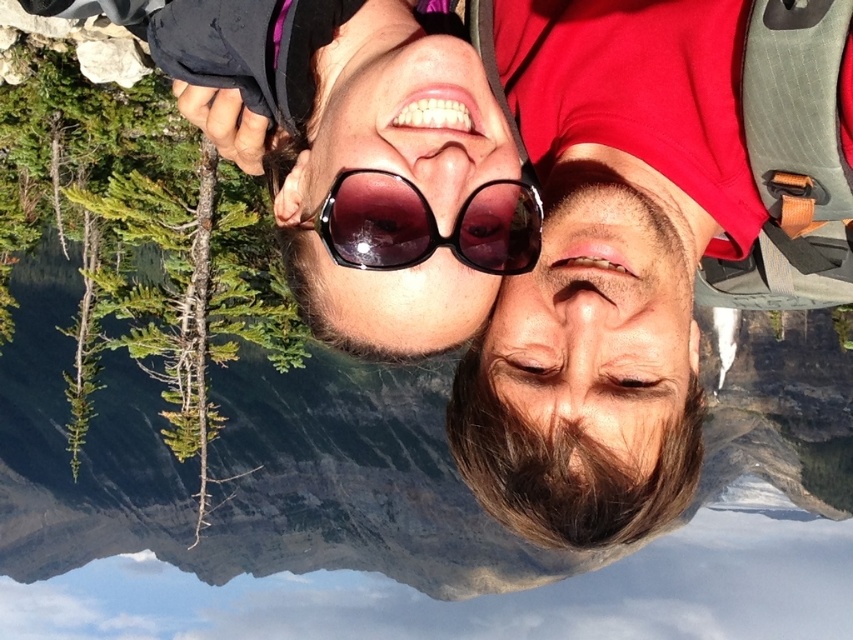
You are a photographer trying to capture a closeup of the transparent plastic goggles at center while also including the matte red shirt at right in the frame. Based on their positions, will you need to adjust your camera angle to the left or right to include both objects in the shot?

The matte red shirt at right is positioned on the right side of transparent plastic goggles at center. To include both in the frame, you should adjust your camera angle to the right to ensure the matte red shirt at right remains in view while capturing the transparent plastic goggles at center.

You are a photographer trying to capture the reflection of the lake in the sunglasses of the person on the left. The reflection point is at coordinates point (648, 243). Which object in the scene is located at that point?

The point (648, 243) corresponds to the matte red shirt at right.